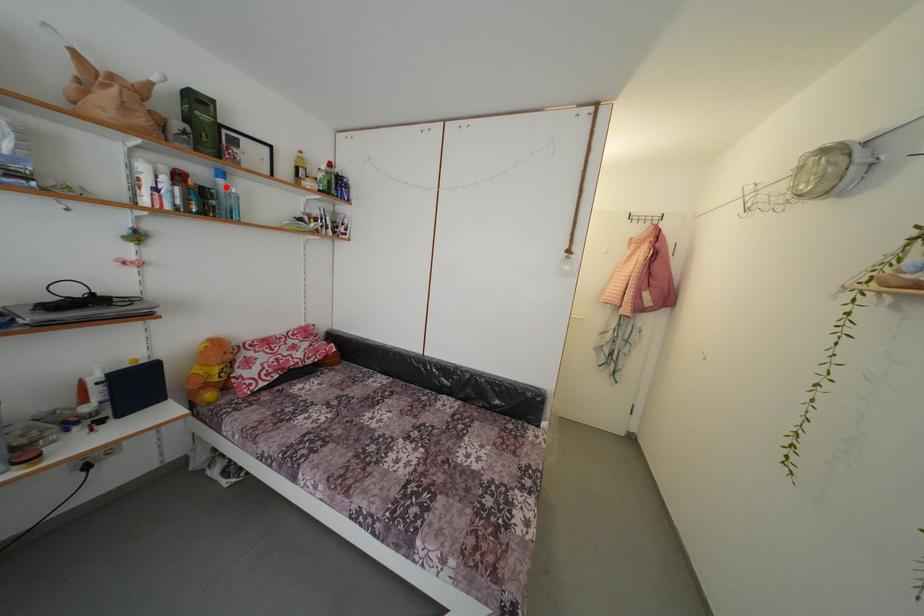
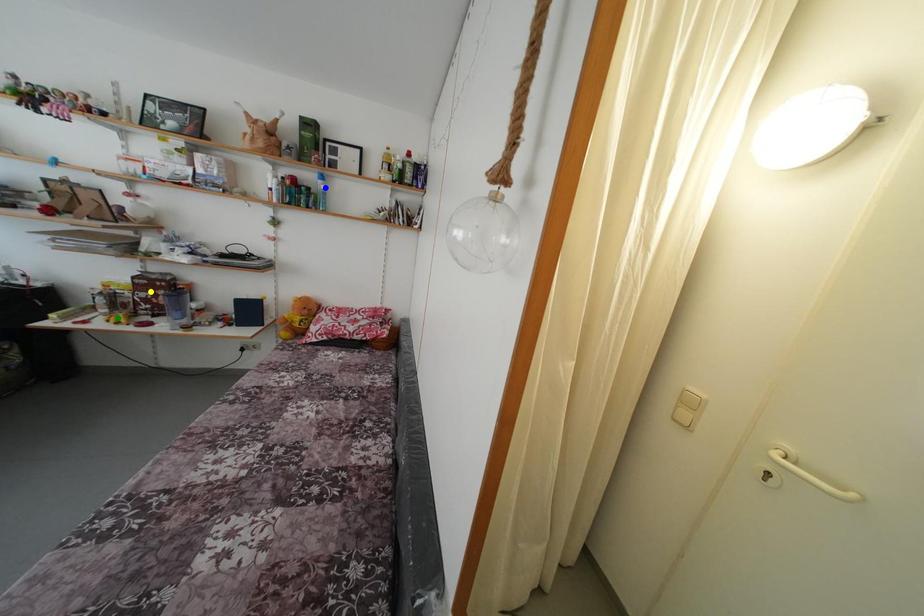
Question: I am providing you with two images of the same scene from different viewpoints. A red point is marked on the first image. You are given multiple points on the second image. Can you choose the point in image 2 that corresponds to the point in image 1?

Choices:
 (A) blue point
 (B) yellow point
 (C) green point

Answer: (A)